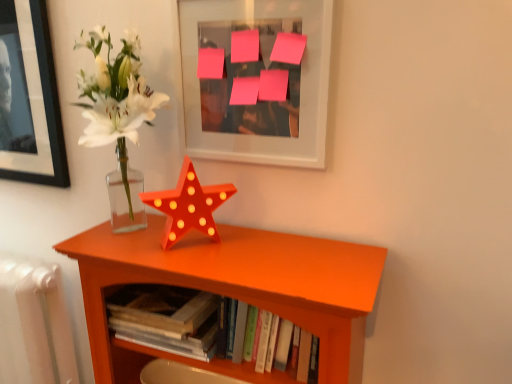
Question: Considering the relative positions of pink paper at upper center and orange wood shelf at center in the image provided, is pink paper at upper center behind orange wood shelf at center?

Choices:
 (A) yes
 (B) no

Answer: (A)

Question: Does pink paper at upper center have a greater height compared to orange wood shelf at center?

Choices:
 (A) no
 (B) yes

Answer: (A)

Question: Considering the relative positions of pink paper at upper center and orange wood shelf at center in the image provided, is pink paper at upper center to the right of orange wood shelf at center from the viewer's perspective?

Choices:
 (A) yes
 (B) no

Answer: (A)

Question: Is pink paper at upper center facing towards orange wood shelf at center?

Choices:
 (A) yes
 (B) no

Answer: (B)

Question: Is pink paper at upper center positioned with its back to orange wood shelf at center?

Choices:
 (A) no
 (B) yes

Answer: (A)

Question: Is point [236, 56] closer or farther from the camera than point [259, 284]?

Choices:
 (A) farther
 (B) closer

Answer: (A)

Question: Relative to orange wood shelf at center, is pink paper at upper center in front or behind?

Choices:
 (A) front
 (B) behind

Answer: (B)

Question: Would you say pink paper at upper center is inside or outside orange wood shelf at center?

Choices:
 (A) inside
 (B) outside

Answer: (B)

Question: From a real-world perspective, relative to orange wood shelf at center, is pink paper at upper center vertically above or below?

Choices:
 (A) above
 (B) below

Answer: (A)

Question: Which is correct: white plastic radiator at lower left is inside pink paper at upper center, or outside of it?

Choices:
 (A) outside
 (B) inside

Answer: (A)

Question: From the image's perspective, is white plastic radiator at lower left above or below pink paper at upper center?

Choices:
 (A) below
 (B) above

Answer: (A)

Question: Considering the positions of white plastic radiator at lower left and pink paper at upper center in the image, is white plastic radiator at lower left taller or shorter than pink paper at upper center?

Choices:
 (A) tall
 (B) short

Answer: (A)

Question: Is point (50, 377) positioned closer to the camera than point (268, 3)?

Choices:
 (A) farther
 (B) closer

Answer: (A)

Question: Do you think matte glass vase at center left is within pink paper at upper center, or outside of it?

Choices:
 (A) outside
 (B) inside

Answer: (A)

Question: Is matte glass vase at center left wider or thinner than pink paper at upper center?

Choices:
 (A) wide
 (B) thin

Answer: (A)